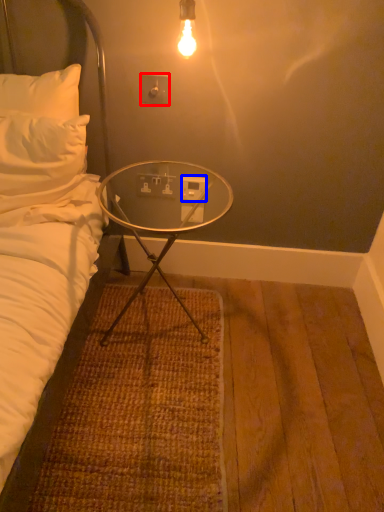
Question: Which object appears farthest to the camera in this image, electric outlet (highlighted by a red box) or power outlet (highlighted by a blue box)?

Choices:
 (A) electric outlet
 (B) power outlet

Answer: (B)